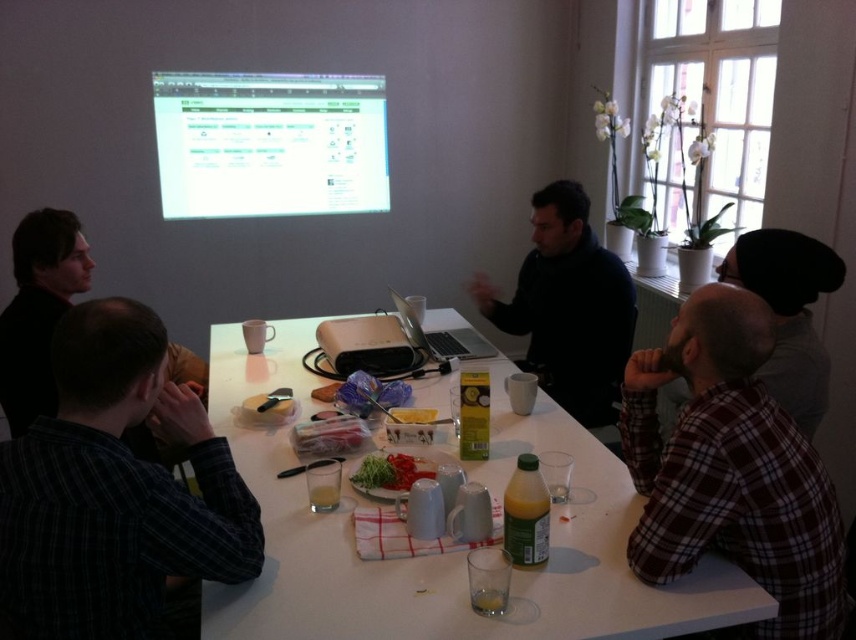
Question: Which of these objects is positioned closest to the silver metallic laptop at center?

Choices:
 (A) white glossy table at center
 (B) matte black projector at center

Answer: (B)

Question: Can you confirm if matte black projector at center is positioned to the right of yellow matte cheese at center?

Choices:
 (A) yes
 (B) no

Answer: (B)

Question: Which point appears closest to the camera in this image?

Choices:
 (A) (229, 99)
 (B) (425, 412)
 (C) (18, 625)

Answer: (C)

Question: Which point is farther to the camera?

Choices:
 (A) dark plaid shirt at lower left
 (B) dark plaid shirt at lower right
 (C) yellow matte cheese at center
 (D) white glossy projection screen at upper center

Answer: (D)

Question: In this image, where is white glossy table at center located relative to smooth brown bread at center?

Choices:
 (A) left
 (B) right

Answer: (B)

Question: In this image, where is silver metallic laptop at center located relative to translucent plastic bag at center?

Choices:
 (A) left
 (B) right

Answer: (B)